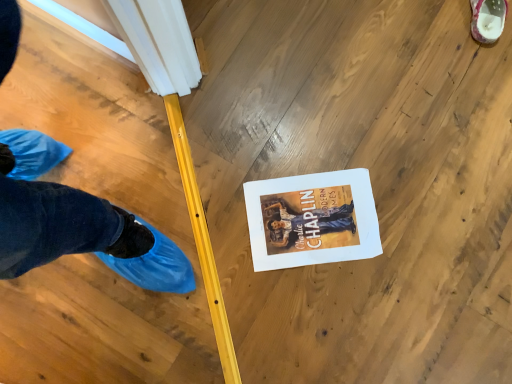
This screenshot has height=384, width=512. I want to click on free space above white paper at center (from a real-world perspective), so click(313, 219).